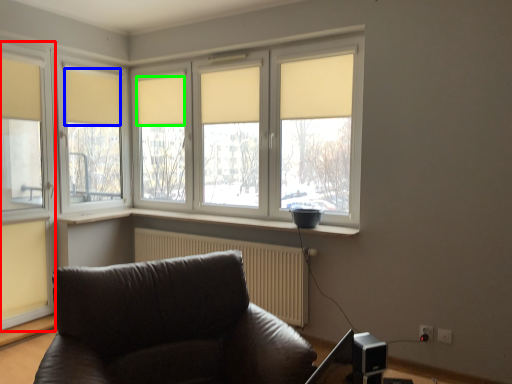
Question: Which is nearer to the window (highlighted by a red box)? curtain (highlighted by a blue box) or curtain (highlighted by a green box).

Choices:
 (A) curtain
 (B) curtain

Answer: (A)